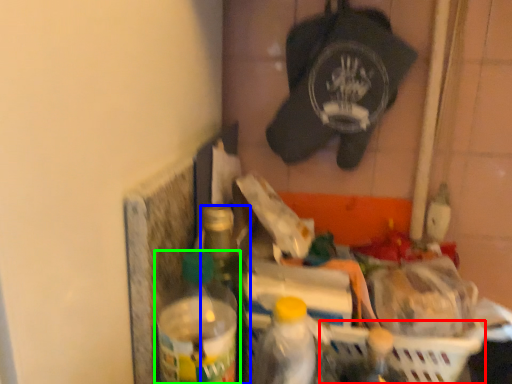
Question: Which object is the closest to the basket (highlighted by a red box)? Choose among these: bottle (highlighted by a blue box) or bottle (highlighted by a green box).

Choices:
 (A) bottle
 (B) bottle

Answer: (A)